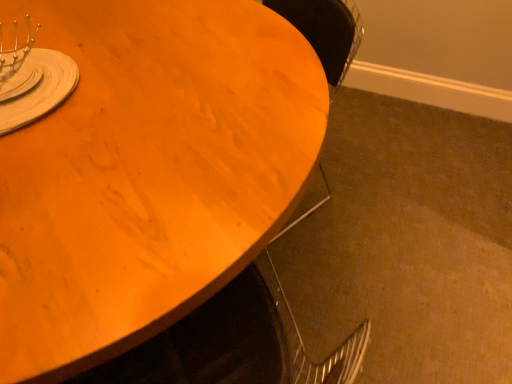
Question: Which is correct: matte silver fork at upper left is inside wooden table at upper left, or outside of it?

Choices:
 (A) outside
 (B) inside

Answer: (A)

Question: Is point (59, 54) closer or farther from the camera than point (286, 120)?

Choices:
 (A) closer
 (B) farther

Answer: (B)

Question: In terms of width, does matte silver fork at upper left look wider or thinner when compared to wooden table at upper left?

Choices:
 (A) wide
 (B) thin

Answer: (B)

Question: Considering the positions of wooden table at upper left and matte silver fork at upper left in the image, is wooden table at upper left bigger or smaller than matte silver fork at upper left?

Choices:
 (A) big
 (B) small

Answer: (A)

Question: From the image's perspective, is wooden table at upper left located above or below matte silver fork at upper left?

Choices:
 (A) below
 (B) above

Answer: (A)

Question: In terms of height, does wooden table at upper left look taller or shorter compared to matte silver fork at upper left?

Choices:
 (A) short
 (B) tall

Answer: (B)

Question: Looking at their shapes, would you say wooden table at upper left is wider or thinner than matte silver fork at upper left?

Choices:
 (A) wide
 (B) thin

Answer: (A)